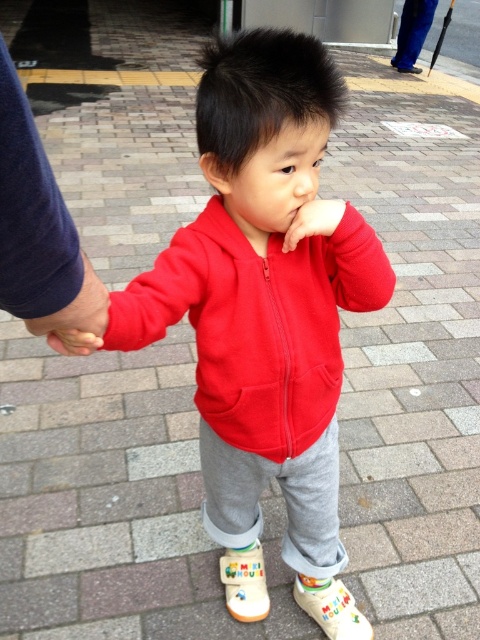
Question: Which of the following is the closest to the observer?

Choices:
 (A) (261, 570)
 (B) (342, 602)
 (C) (397, 70)
 (D) (94, 273)

Answer: (D)

Question: Which object appears closest to the camera in this image?

Choices:
 (A) white rubber shoe at lower right
 (B) blue fabric hand at left
 (C) white rubber boot at lower center
 (D) white fabric shoe at lower right

Answer: (B)

Question: Is matte fleece jacket at center bigger than white fabric shoe at lower right?

Choices:
 (A) no
 (B) yes

Answer: (B)

Question: Is matte fleece jacket at center thinner than white rubber shoe at lower right?

Choices:
 (A) no
 (B) yes

Answer: (A)

Question: Which is farther from the dark blue fabric at left?

Choices:
 (A) white rubber shoe at lower right
 (B) white fabric shoe at lower right
 (C) white rubber boot at lower center

Answer: (A)

Question: Is dark blue fabric at left bigger than white rubber shoe at lower right?

Choices:
 (A) no
 (B) yes

Answer: (A)